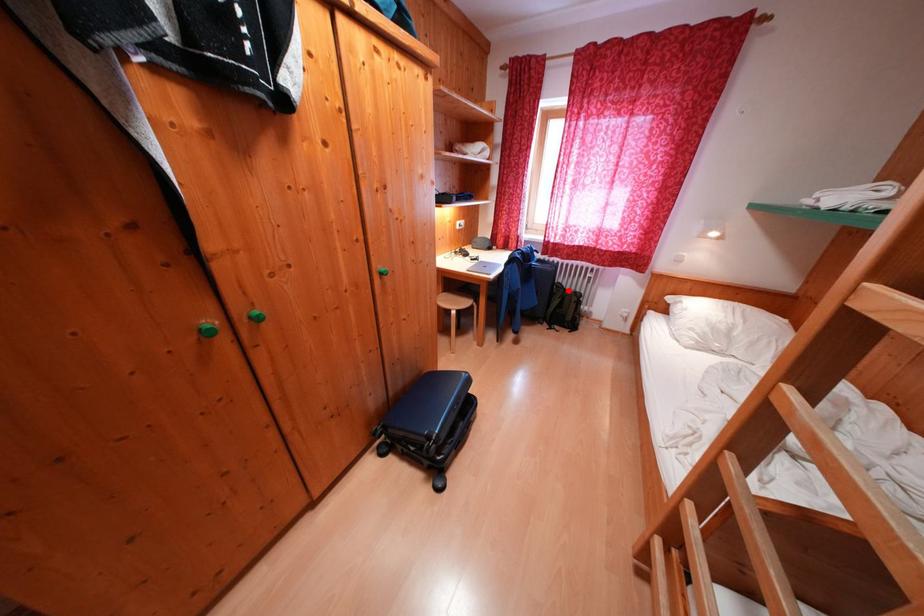
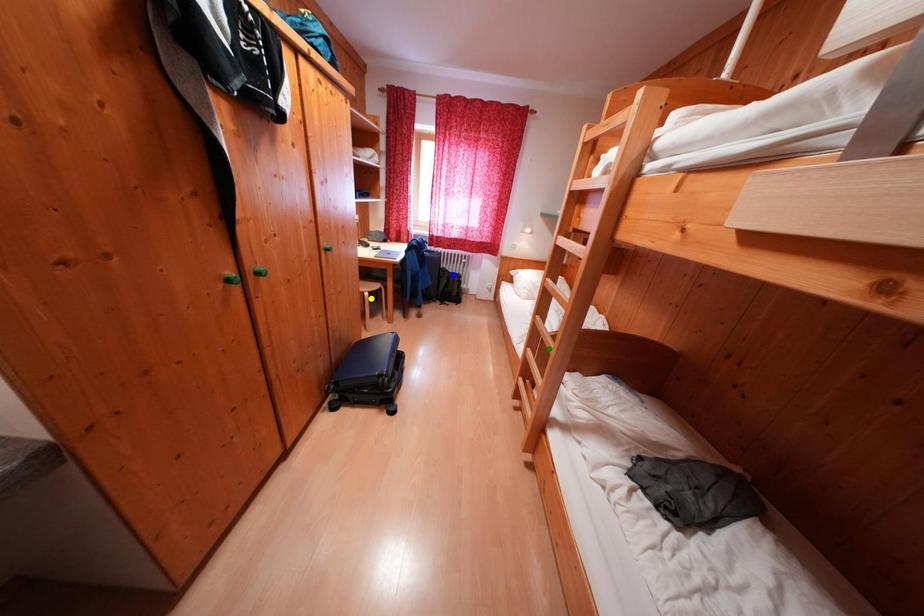
Question: I am providing you with two images of the same scene from different viewpoints. A red point is marked on the first image. You are given multiple points on the second image. Which point in image 2 represents the same 3d spot as the red point in image 1?

Choices:
 (A) blue point
 (B) yellow point
 (C) green point

Answer: (A)